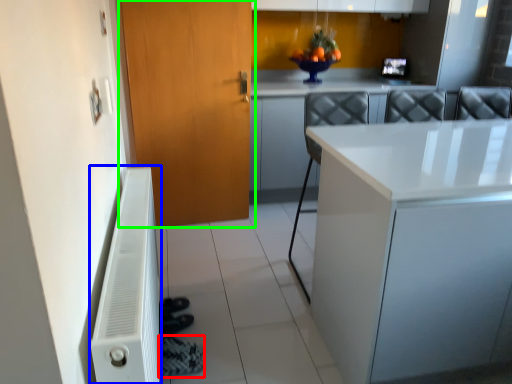
Question: Which object is positioned farthest from shoe (highlighted by a red box)? Select from radiator (highlighted by a blue box) and door (highlighted by a green box).

Choices:
 (A) radiator
 (B) door

Answer: (B)